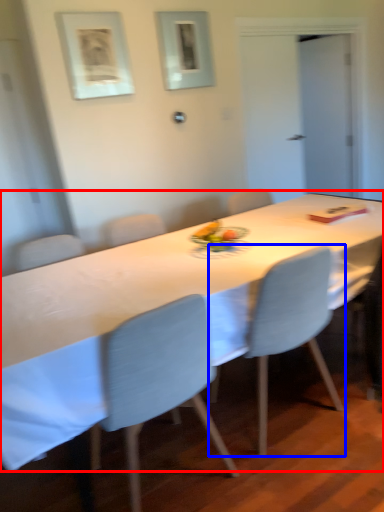
Question: Which point is closer to the camera, table (highlighted by a red box) or chair (highlighted by a blue box)?

Choices:
 (A) table
 (B) chair

Answer: (A)